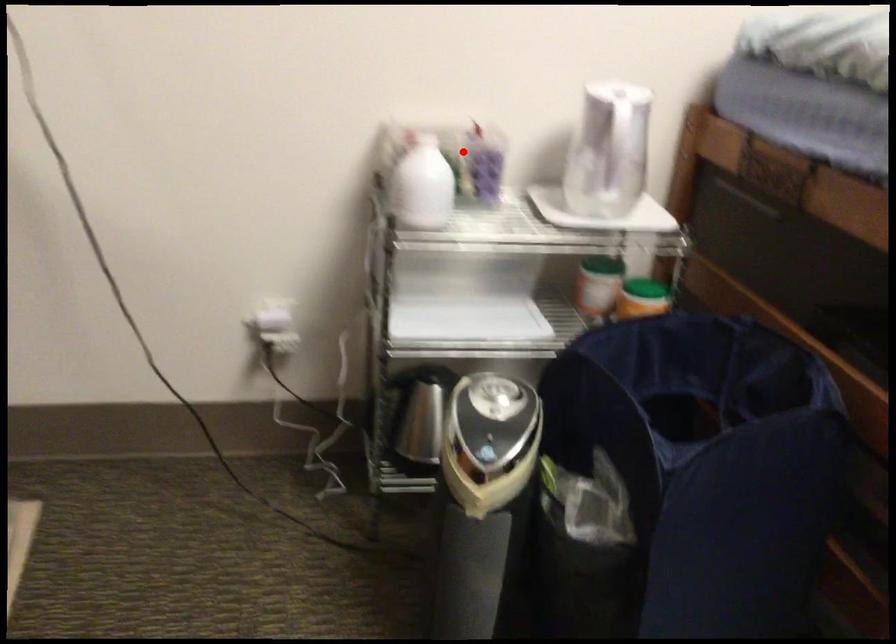
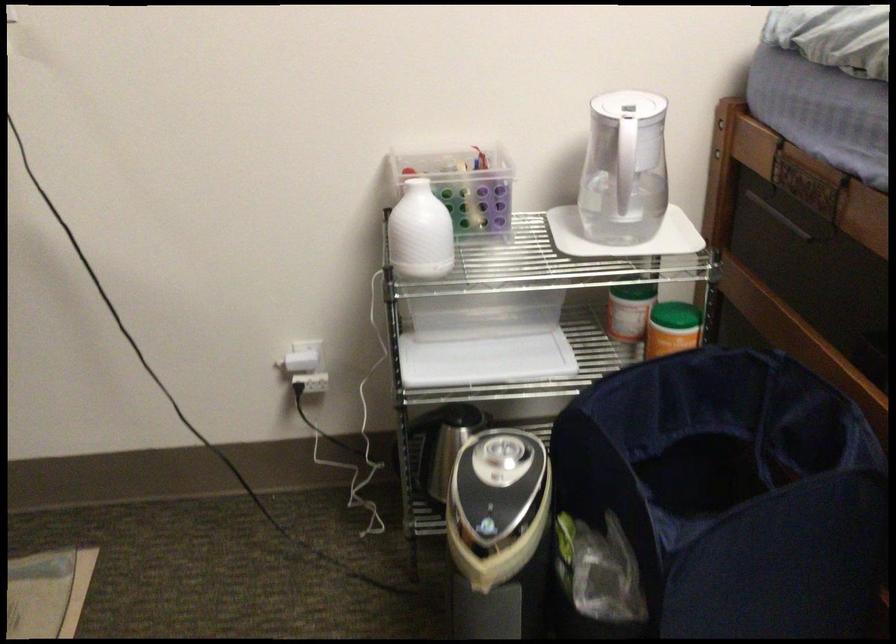
In the second image, find the point that corresponds to the highlighted location in the first image.

(463, 185)